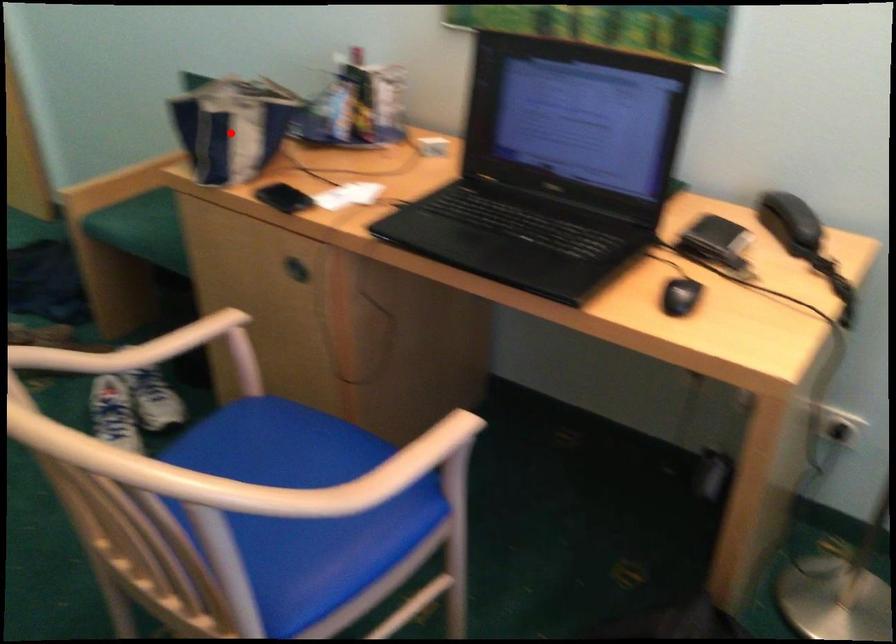
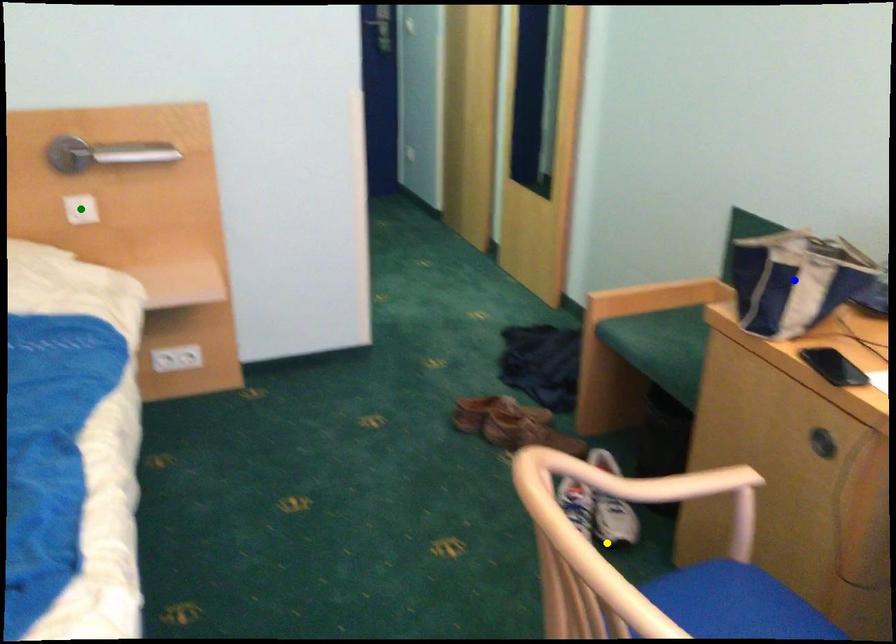
Question: I am providing you with two images of the same scene from different viewpoints. A red point is marked on the first image. You are given multiple points on the second image. Can you choose the point in image 2 that corresponds to the point in image 1?

Choices:
 (A) green point
 (B) blue point
 (C) yellow point

Answer: (B)